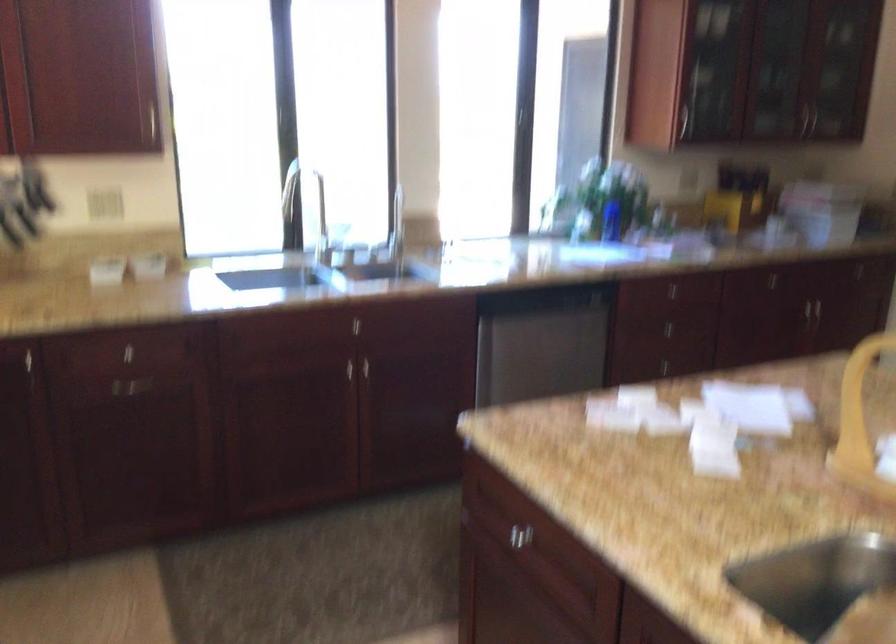
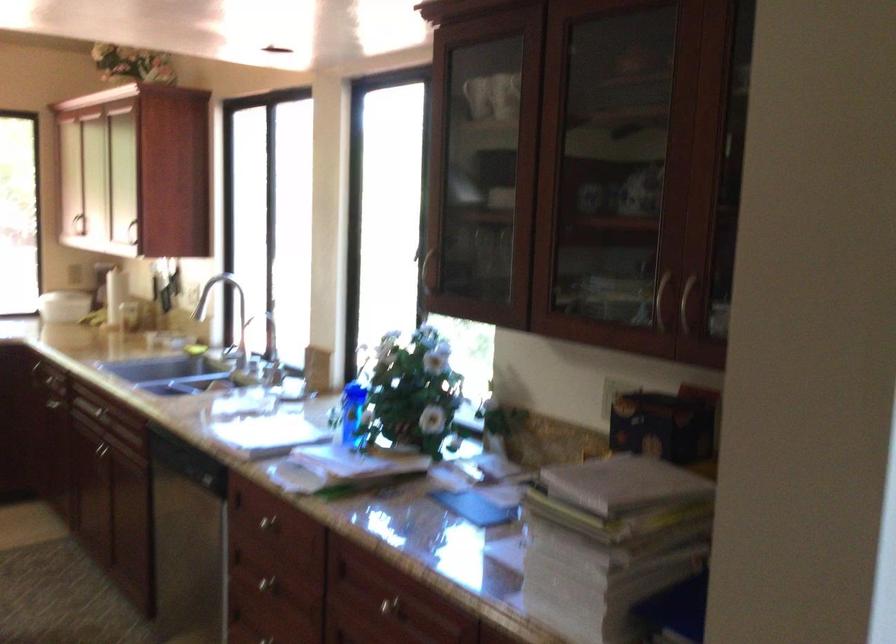
In the second image, find the point that corresponds to (x=694, y=281) in the first image.

(266, 522)